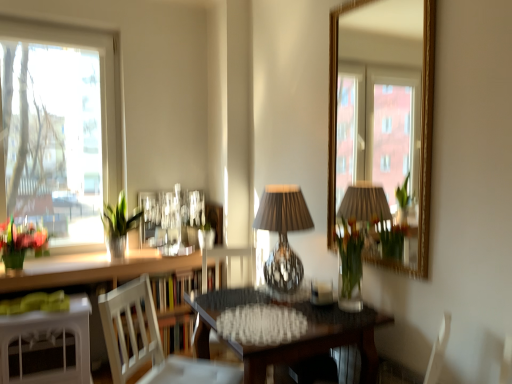
The image size is (512, 384). I want to click on free space above clear glass window at left (from a real-world perspective), so click(x=57, y=26).